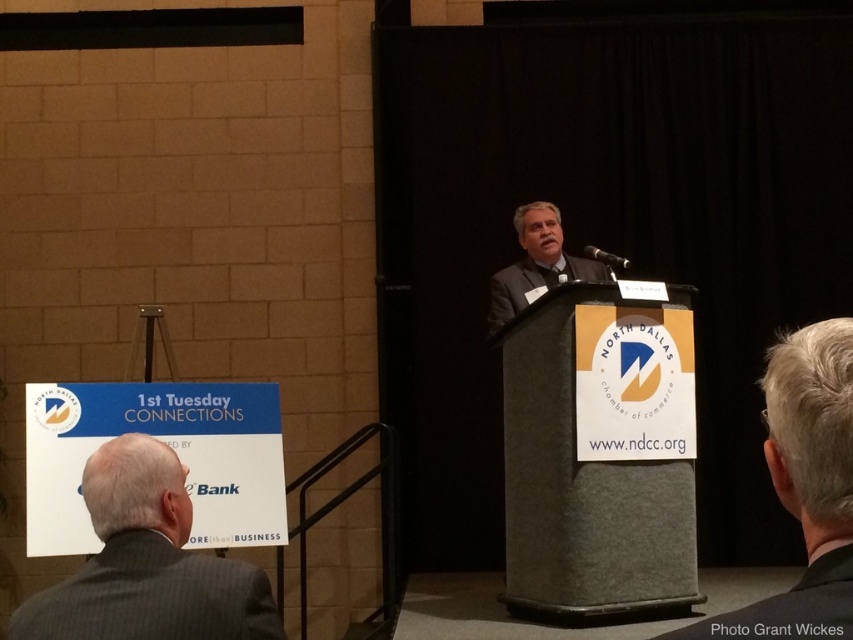
Does gray hair at center come in front of gray suit at center?

Yes.

Is gray hair at center further to camera compared to gray suit at center?

No, gray hair at center is in front of gray suit at center.

Who is more distant from viewer, (781,412) or (503,291)?

Positioned behind is point (503,291).

The image size is (853, 640). Identify the location of gray hair at center. (804, 486).

Where is `gray suit at lower left`? Image resolution: width=853 pixels, height=640 pixels. gray suit at lower left is located at coordinates (148, 563).

Who is lower down, gray suit at lower left or gray suit at center?

gray suit at lower left

Who is more distant from viewer, (142, 579) or (527, 221)?

The point (527, 221) is more distant.

Locate an element on the screen. This screenshot has width=853, height=640. gray suit at lower left is located at coordinates (148, 563).

Does gray suit at lower left come in front of gray hair at center?

That is False.

Does point (143, 595) lie behind point (769, 358)?

Yes, it is behind point (769, 358).

Identify the location of gray suit at lower left. (148, 563).